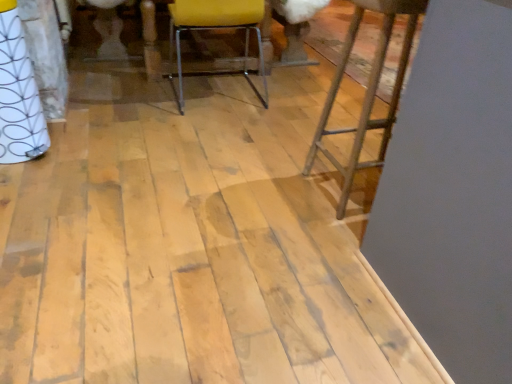
Locate an element on the screen. The image size is (512, 384). free spot in front of yellow fabric chair at center is located at coordinates (219, 131).